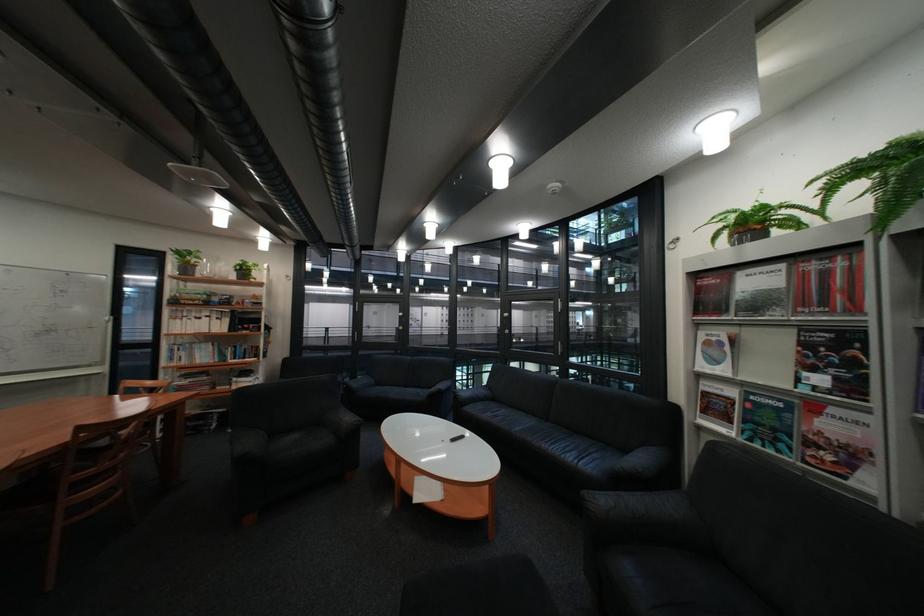
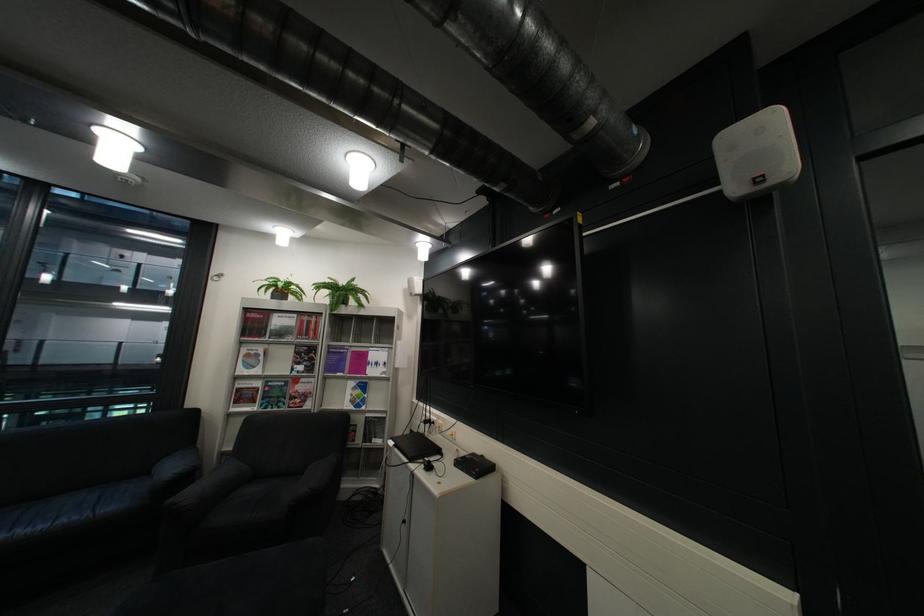
The point at (720, 394) is marked in the first image. Where is the corresponding point in the second image?

(254, 390)